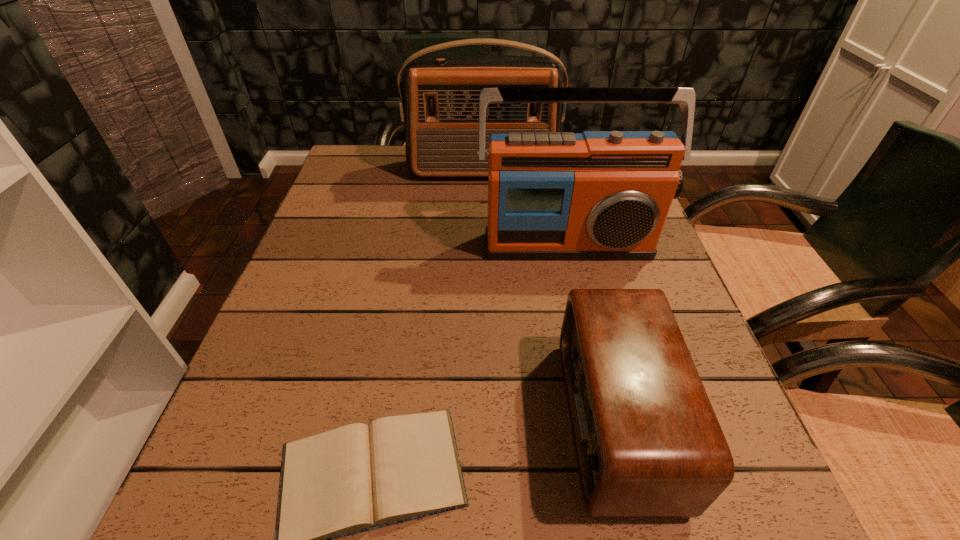
At what (x,y) coordinates should I click in order to perform the action: click on object that can be found as the closest to the second nearest radio receiver. Please return your answer as a coordinate pair (x, y). The width and height of the screenshot is (960, 540). Looking at the image, I should click on (440, 107).

Locate an element on the screen. The width and height of the screenshot is (960, 540). the second closest object to the shortest object is located at coordinates (598, 195).

This screenshot has width=960, height=540. I want to click on the second closest radio receiver to the third nearest object, so click(x=648, y=444).

You are a GUI agent. You are given a task and a screenshot of the screen. Output one action in this format:
    pyautogui.click(x=<x>, y=<y>)
    Task: Click on the closest radio receiver to the Bible
    The width and height of the screenshot is (960, 540).
    Given the screenshot: What is the action you would take?
    pyautogui.click(x=648, y=444)